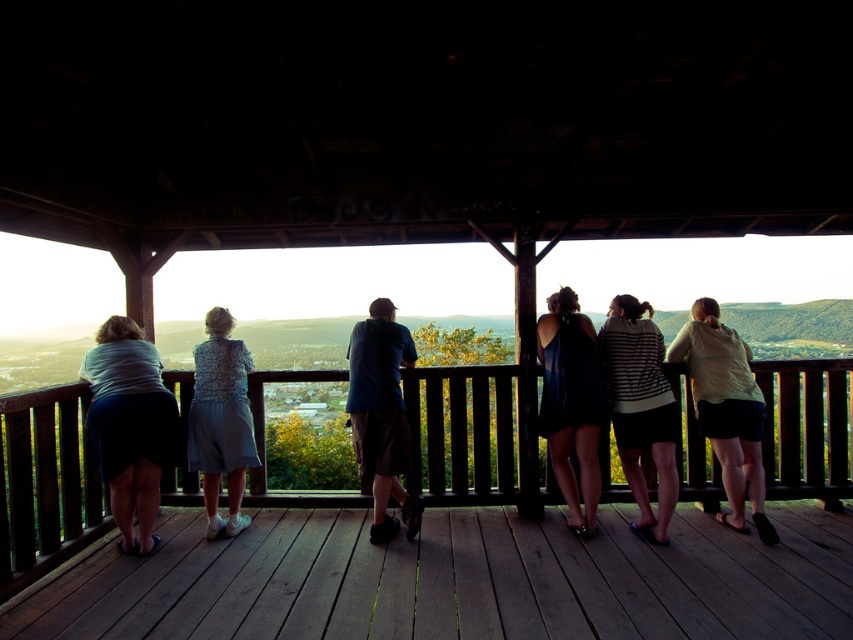
Can you confirm if wooden deck at center is positioned below light yellow shirt at center?

Yes.

Who is more forward, (786, 636) or (769, 525)?

Point (786, 636) is in front.

At what (x,y) coordinates should I click in order to perform the action: click on wooden deck at center. Please return your answer as a coordinate pair (x, y). Looking at the image, I should click on (454, 579).

Does matte blue dress at center appear on the right side of light blue fabric dress at left?

Indeed, matte blue dress at center is positioned on the right side of light blue fabric dress at left.

Does point (576, 301) lie in front of point (194, 394)?

No.

Which is behind, point (556, 401) or point (196, 400)?

The point (196, 400) is more distant.

Where is `matte blue dress at center`? matte blue dress at center is located at coordinates (572, 403).

Does wooden porch at center have a lesser height compared to striped hoodie at center?

Yes, wooden porch at center is shorter than striped hoodie at center.

Is wooden porch at center closer to camera compared to striped hoodie at center?

Yes, it is.

Identify the location of wooden porch at center. pyautogui.click(x=448, y=576).